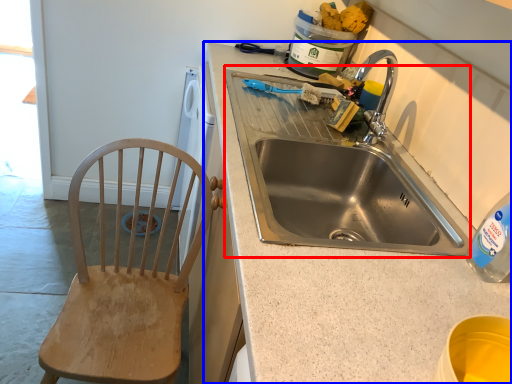
Question: Which object appears closest to the camera in this image, sink (highlighted by a red box) or countertop (highlighted by a blue box)?

Choices:
 (A) sink
 (B) countertop

Answer: (B)